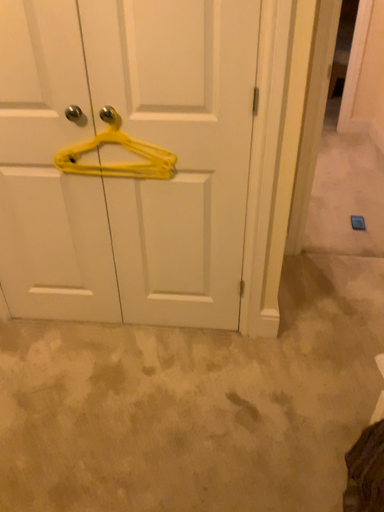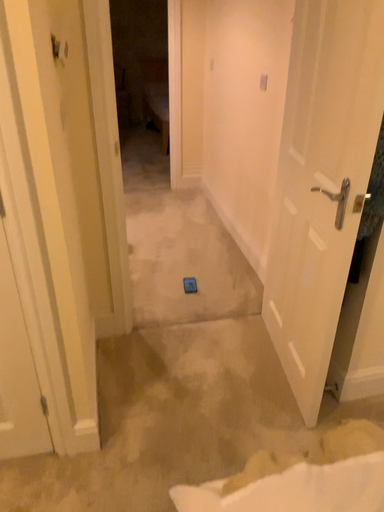
Question: Which way did the camera rotate in the video?

Choices:
 (A) rotated upward
 (B) rotated downward

Answer: (A)